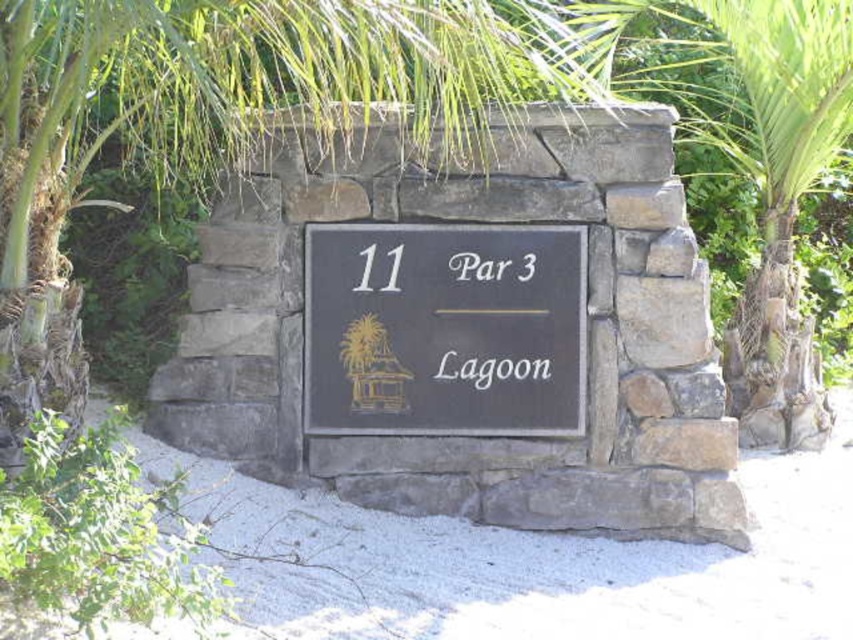
Based on the photo, is the position of black slate sign at center less distant than that of black matte sign at center?

That is True.

Between black slate sign at center and black matte sign at center, which one has more height?

Standing taller between the two is black slate sign at center.

Locate an element on the screen. The width and height of the screenshot is (853, 640). black slate sign at center is located at coordinates coord(444,330).

Is green leafy palm tree at upper center above black matte sign at center?

Indeed, green leafy palm tree at upper center is positioned over black matte sign at center.

Describe the element at coordinates (218, 115) in the screenshot. I see `green leafy palm tree at upper center` at that location.

Does point (193, 29) come farther from viewer compared to point (485, 374)?

No, (193, 29) is in front of (485, 374).

The image size is (853, 640). Identify the location of green leafy palm tree at upper center. (218, 115).

Is green leafy palm tree at upper center thinner than black slate sign at center?

No, green leafy palm tree at upper center is not thinner than black slate sign at center.

Who is shorter, green leafy palm tree at upper center or black slate sign at center?

With less height is black slate sign at center.

What are the coordinates of `green leafy palm tree at upper center` in the screenshot? It's located at (218, 115).

This screenshot has height=640, width=853. In order to click on green leafy palm tree at upper center in this screenshot , I will do `click(218, 115)`.